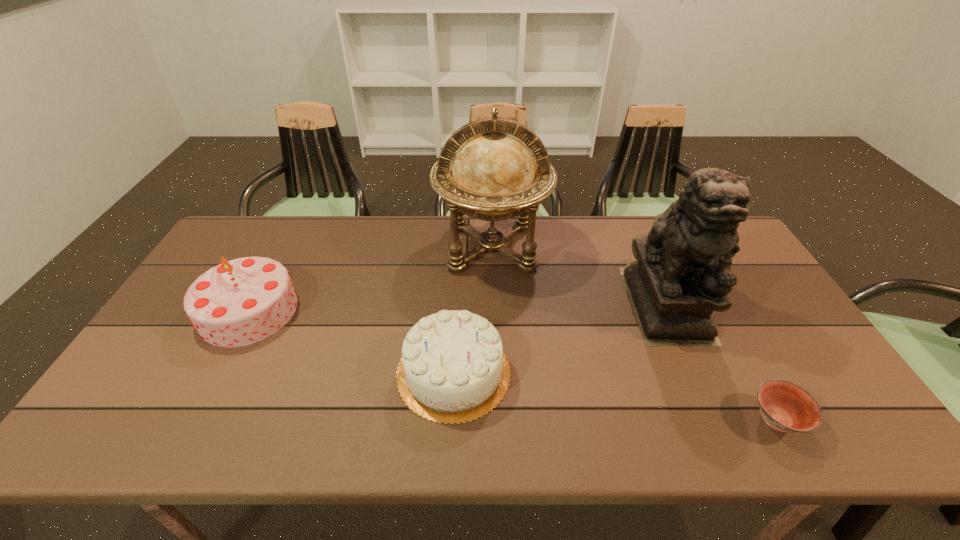
This screenshot has height=540, width=960. I want to click on free spot at the left edge of the desktop, so click(187, 349).

Find the location of `free space at the right edge of the desktop`. free space at the right edge of the desktop is located at coordinates (807, 355).

I want to click on vacant position at the far left corner of the desktop, so click(243, 232).

At what (x,y) coordinates should I click in order to perform the action: click on free spot at the near left corner of the desktop. Please return your answer as a coordinate pair (x, y). Looking at the image, I should click on (156, 426).

The height and width of the screenshot is (540, 960). Identify the location of vacant region between the left birthday cake and the globe. (371, 279).

In order to click on free space between the shorter birthday cake and the globe in this screenshot , I will do `click(473, 309)`.

The width and height of the screenshot is (960, 540). I want to click on empty space between the bowl and the left birthday cake, so click(x=513, y=366).

Locate an element on the screen. free area in between the right birthday cake and the globe is located at coordinates (473, 309).

Find the location of a particular element. vacant area between the sculpture and the shorter birthday cake is located at coordinates (560, 338).

Where is `vacant point located between the third shortest object and the right birthday cake`? This screenshot has width=960, height=540. vacant point located between the third shortest object and the right birthday cake is located at coordinates (351, 341).